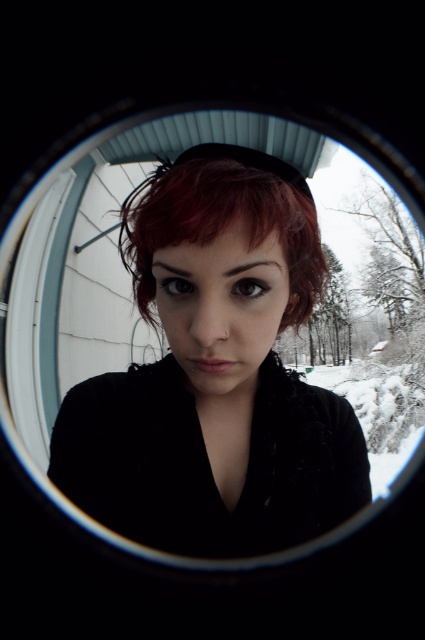
Question: Can you confirm if matte black hair at center is positioned above dark red hair at center?

Choices:
 (A) yes
 (B) no

Answer: (B)

Question: Which of the following is the closest to the observer?

Choices:
 (A) (183, 316)
 (B) (133, 243)

Answer: (A)

Question: Does matte black hair at center have a greater width compared to dark red hair at center?

Choices:
 (A) yes
 (B) no

Answer: (B)

Question: Which of the following is the closest to the observer?

Choices:
 (A) (121, 248)
 (B) (187, 157)

Answer: (B)

Question: Is matte black hair at center wider than dark red hair at center?

Choices:
 (A) no
 (B) yes

Answer: (A)

Question: Which point appears farthest from the camera in this image?

Choices:
 (A) (212, 157)
 (B) (198, 502)

Answer: (B)